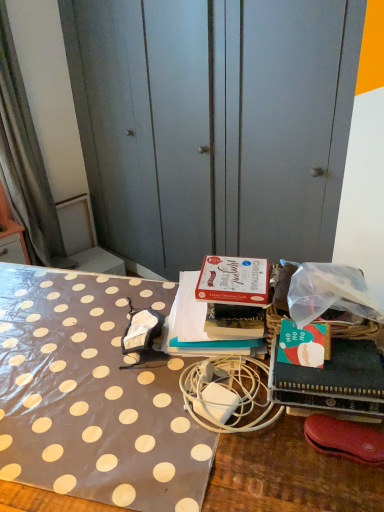
Locate an element on the screen. The height and width of the screenshot is (512, 384). free space above polka dot fabric at center (from a real-world perspective) is located at coordinates (124, 374).